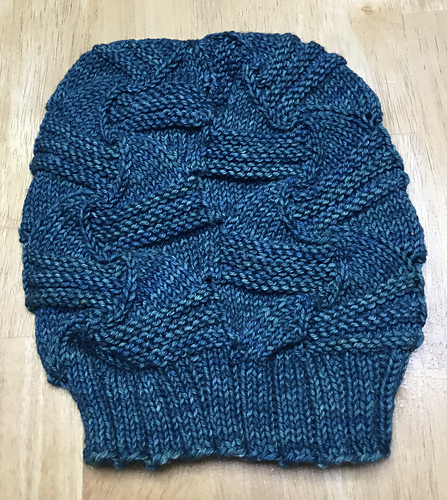
Identify the location of countertop. (57, 472), (232, 486), (407, 442), (431, 234), (18, 243), (226, 9).